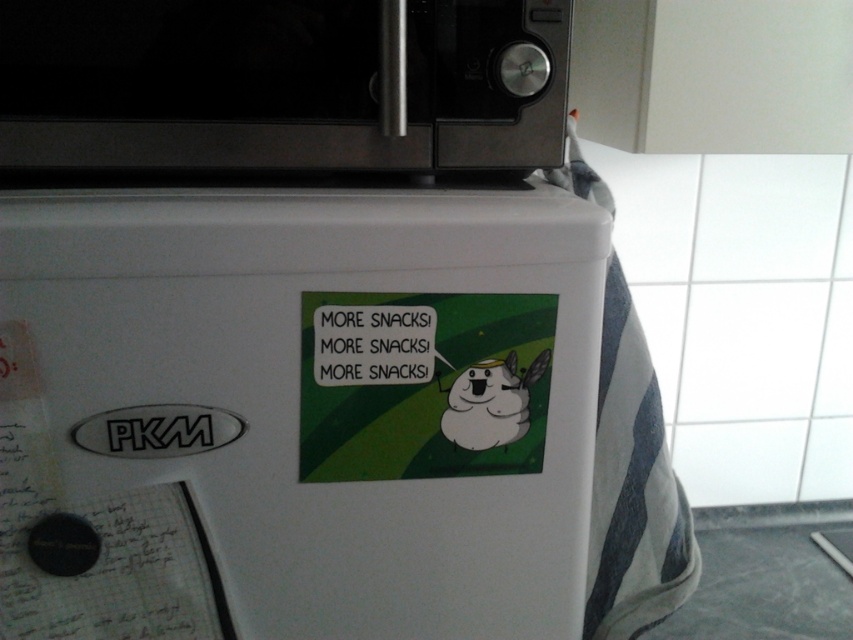
Question: In this image, where is black matte microwave at upper center located relative to green matte sticker at center?

Choices:
 (A) left
 (B) right

Answer: (A)

Question: Which object is farther from the camera taking this photo?

Choices:
 (A) black matte microwave at upper center
 (B) green matte sticker at center

Answer: (B)

Question: Can you confirm if white matte refrigerator at center is positioned to the right of black matte microwave at upper center?

Choices:
 (A) yes
 (B) no

Answer: (A)

Question: Which point is closer to the camera?

Choices:
 (A) (86, 580)
 (B) (381, 374)

Answer: (A)

Question: Can you confirm if black matte microwave at upper center is thinner than green matte sticker at center?

Choices:
 (A) no
 (B) yes

Answer: (A)

Question: Which of the following is the closest to the observer?

Choices:
 (A) (316, 228)
 (B) (36, 154)

Answer: (A)